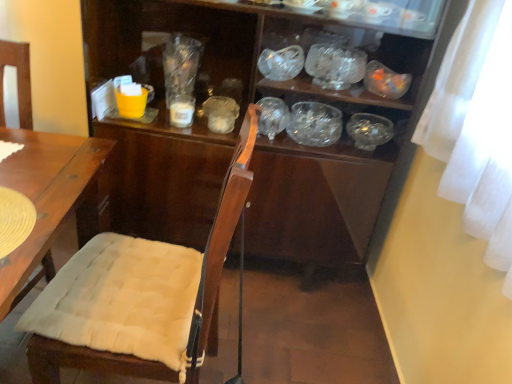
Question: Is transparent glass bowl at center, which ranks as the first glass bowl in bottom-to-top order, to the left of transparent glass bowl at center, the 4th tableware from the left, from the viewer's perspective?

Choices:
 (A) yes
 (B) no

Answer: (A)

Question: From a real-world perspective, is transparent glass bowl at center, positioned as the 2th glass bowl in top-to-bottom order, positioned over transparent glass bowl at center, acting as the first tableware starting from the right, based on gravity?

Choices:
 (A) no
 (B) yes

Answer: (A)

Question: Does transparent glass bowl at center, which ranks as the first glass bowl in bottom-to-top order, touch transparent glass bowl at center, the 4th tableware from the left?

Choices:
 (A) yes
 (B) no

Answer: (B)

Question: Could you tell me if transparent glass bowl at center, positioned as the 2th glass bowl in top-to-bottom order, is facing transparent glass bowl at center, acting as the first tableware starting from the right?

Choices:
 (A) yes
 (B) no

Answer: (B)

Question: From the image's perspective, is transparent glass bowl at center, which ranks as the first glass bowl in bottom-to-top order, above transparent glass bowl at center, acting as the first tableware starting from the right?

Choices:
 (A) no
 (B) yes

Answer: (B)

Question: Choose the correct answer: Is clear glass bowl at upper center, which is the second tableware from right to left, inside transparent glass bowl at center, the 4th tableware from the left, or outside it?

Choices:
 (A) outside
 (B) inside

Answer: (A)

Question: In terms of width, does clear glass bowl at upper center, the 3th tableware viewed from the left, look wider or thinner when compared to transparent glass bowl at center, the 4th tableware from the left?

Choices:
 (A) thin
 (B) wide

Answer: (B)

Question: Visually, is clear glass bowl at upper center, the 3th tableware viewed from the left, positioned to the left or to the right of transparent glass bowl at center, acting as the first tableware starting from the right?

Choices:
 (A) right
 (B) left

Answer: (B)

Question: From a real-world perspective, relative to transparent glass bowl at center, the 4th tableware from the left, is clear glass bowl at upper center, the 3th tableware viewed from the left, vertically above or below?

Choices:
 (A) above
 (B) below

Answer: (A)

Question: From a real-world perspective, is transparent glass bowl at upper center, the 1th glass bowl in the top-to-bottom sequence, above or below white glossy cup at center, the 3th tableware when ordered from right to left?

Choices:
 (A) below
 (B) above

Answer: (B)

Question: In terms of size, does transparent glass bowl at upper center, the 1th glass bowl in the top-to-bottom sequence, appear bigger or smaller than white glossy cup at center, the 2th tableware positioned from the left?

Choices:
 (A) big
 (B) small

Answer: (A)

Question: Would you say transparent glass bowl at upper center, the 1th glass bowl in the top-to-bottom sequence, is inside or outside white glossy cup at center, the 2th tableware positioned from the left?

Choices:
 (A) inside
 (B) outside

Answer: (B)

Question: From the image's perspective, relative to white glossy cup at center, the 3th tableware when ordered from right to left, is transparent glass bowl at upper center, positioned as the 2th glass bowl in bottom-to-top order, above or below?

Choices:
 (A) above
 (B) below

Answer: (A)

Question: Considering the positions of transparent plastic cup at upper center and clear glass bowl at upper center, the 3th tableware viewed from the left, in the image, is transparent plastic cup at upper center taller or shorter than clear glass bowl at upper center, the 3th tableware viewed from the left,?

Choices:
 (A) short
 (B) tall

Answer: (B)

Question: Is point (187, 82) closer or farther from the camera than point (280, 77)?

Choices:
 (A) closer
 (B) farther

Answer: (B)